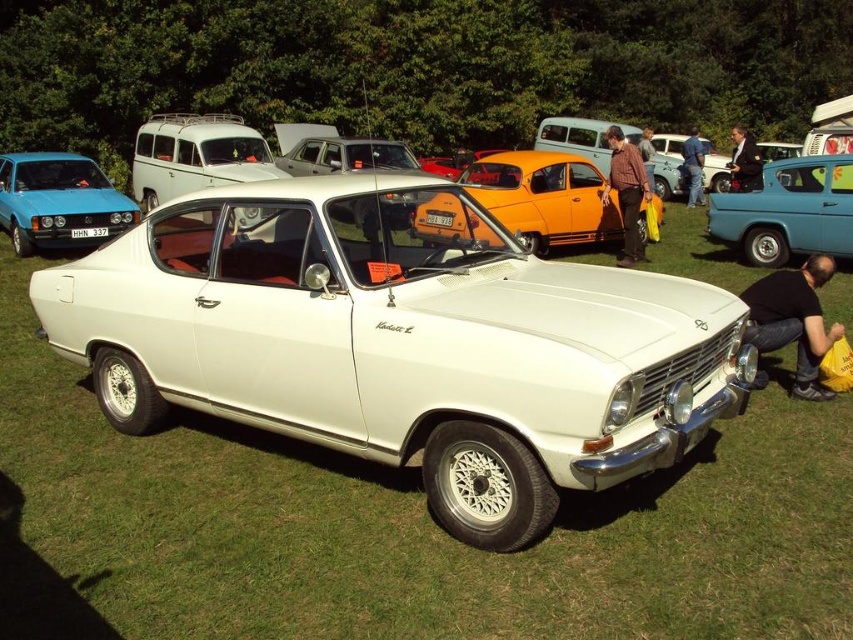
Describe the element at coordinates (544, 196) in the screenshot. I see `orange matte car at center` at that location.

Which is behind, point (613, 236) or point (177, 168)?

The point (177, 168) is more distant.

This screenshot has height=640, width=853. I want to click on orange matte car at center, so click(x=544, y=196).

You are a GUI agent. You are given a task and a screenshot of the screen. Output one action in this format:
    pyautogui.click(x=<x>, y=<y>)
    Task: Click on the orange matte car at center
    The width and height of the screenshot is (853, 640).
    Given the screenshot: What is the action you would take?
    pyautogui.click(x=544, y=196)

Which is behind, point (641, 196) or point (45, 166)?

Positioned behind is point (45, 166).

Can you confirm if orange matte car at center is wider than matte blue hatchback at left?

Yes, orange matte car at center is wider than matte blue hatchback at left.

You are a GUI agent. You are given a task and a screenshot of the screen. Output one action in this format:
    pyautogui.click(x=<x>, y=<y>)
    Task: Click on the orange matte car at center
    The image size is (853, 640).
    Given the screenshot: What is the action you would take?
    pyautogui.click(x=544, y=196)

Where is `orange matte car at center`? This screenshot has height=640, width=853. orange matte car at center is located at coordinates (544, 196).

Does white matte car at center have a larger size compared to blue jeans at lower right?

Yes, white matte car at center is bigger than blue jeans at lower right.

The image size is (853, 640). Describe the element at coordinates (401, 340) in the screenshot. I see `white matte car at center` at that location.

I want to click on white matte car at center, so click(401, 340).